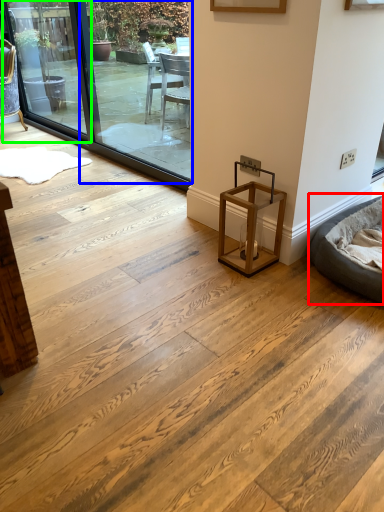
Question: Estimate the real-world distances between objects in this image. Which object is closer to bean bag chair (highlighted by a red box), window screen (highlighted by a blue box) or window screen (highlighted by a green box)?

Choices:
 (A) window screen
 (B) window screen

Answer: (A)